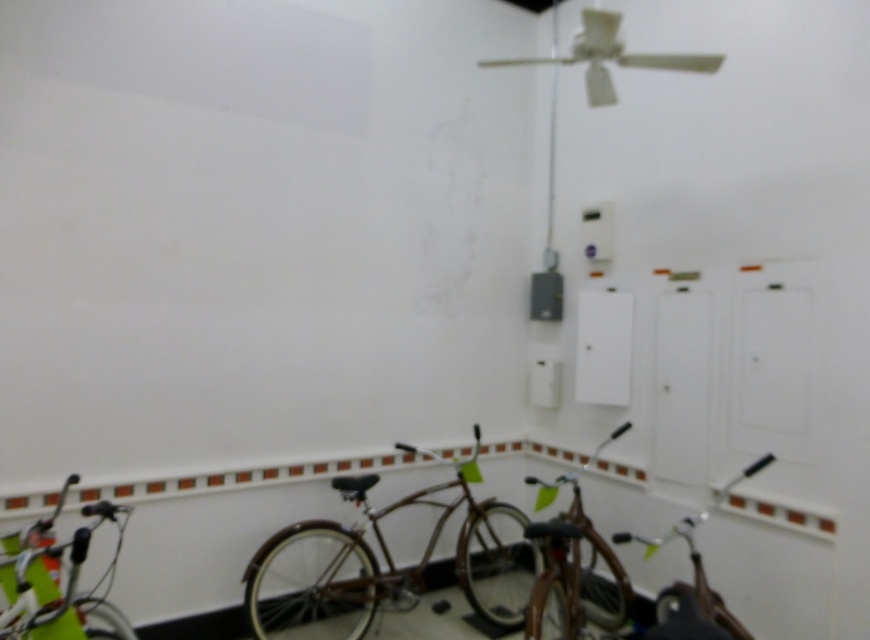
You are standing in the room and want to move from the white glossy bicycle at lower left to the shiny brown bicycle at center. Which direction should you move to get there?

You should move to the right to reach the shiny brown bicycle at center since the white glossy bicycle at lower left is positioned to the left of it.